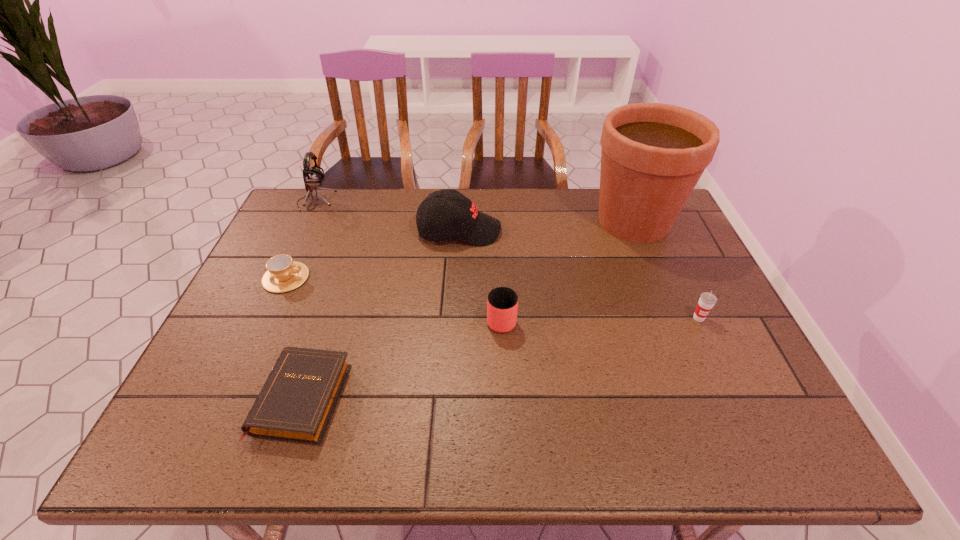
Identify the location of the tallest object. (653, 154).

This screenshot has height=540, width=960. Identify the location of the sixth shortest object. (312, 176).

At what (x,y) coordinates should I click in order to perform the action: click on the third tallest object. Please return your answer as a coordinate pair (x, y). Looking at the image, I should click on (460, 218).

Identify the location of the rightmost cup. (707, 300).

Identify the location of the second cup from right to left. (502, 303).

Where is `the shortest cup`? The image size is (960, 540). the shortest cup is located at coordinates (283, 274).

The height and width of the screenshot is (540, 960). What are the coordinates of `the leftmost cup` in the screenshot? It's located at pyautogui.click(x=283, y=274).

Locate an element on the screen. the nearest object is located at coordinates (296, 404).

Find the location of a particular element. Image resolution: width=960 pixels, height=540 pixels. the third object from left to right is located at coordinates (296, 404).

Identify the location of blank space located on the front of the flowerpot. This screenshot has height=540, width=960. (670, 309).